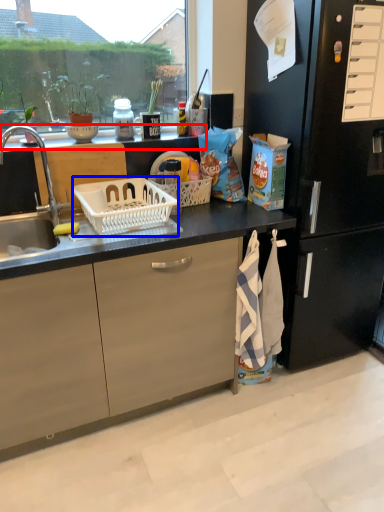
Question: Which point is closer to the camera, window sill (highlighted by a red box) or picnic basket (highlighted by a blue box)?

Choices:
 (A) window sill
 (B) picnic basket

Answer: (B)